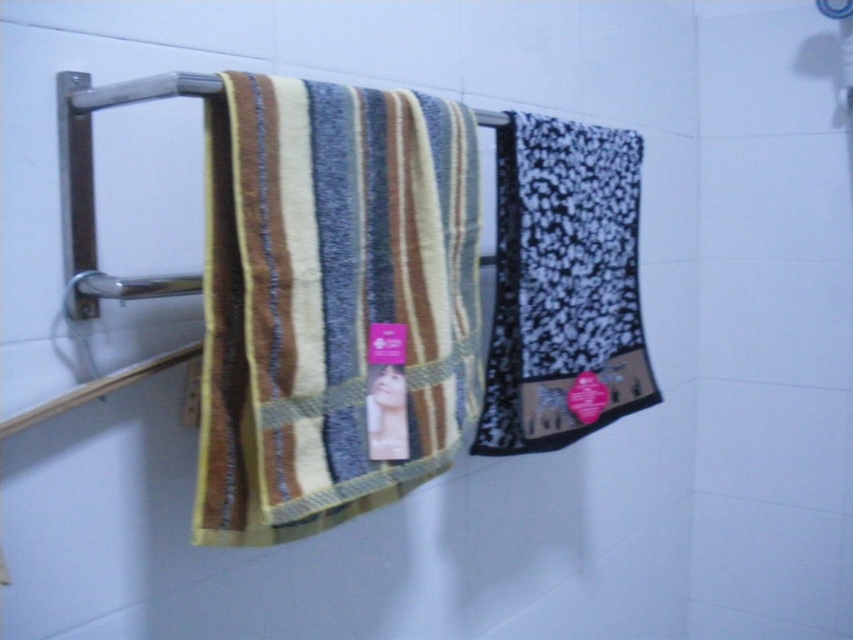
Question: Can you confirm if multicolored woven towel at center is positioned to the right of black textured towel at right?

Choices:
 (A) no
 (B) yes

Answer: (A)

Question: Which point appears farthest from the camera in this image?

Choices:
 (A) (639, 348)
 (B) (396, 374)

Answer: (A)

Question: Can you confirm if multicolored woven towel at center is thinner than black textured towel at right?

Choices:
 (A) no
 (B) yes

Answer: (B)

Question: Does multicolored woven towel at center have a lesser width compared to black textured towel at right?

Choices:
 (A) yes
 (B) no

Answer: (A)

Question: Which of the following is the closest to the observer?

Choices:
 (A) (566, 195)
 (B) (374, 483)

Answer: (B)

Question: Which point is farther to the camera?

Choices:
 (A) black textured towel at right
 (B) multicolored woven towel at center

Answer: (A)